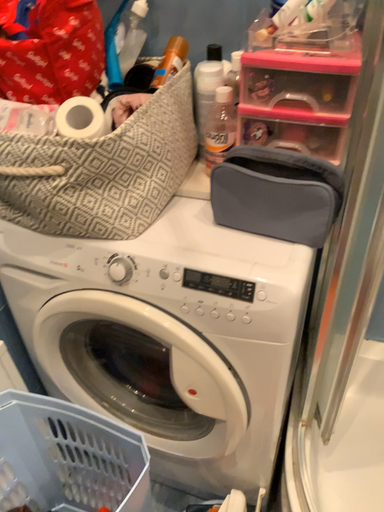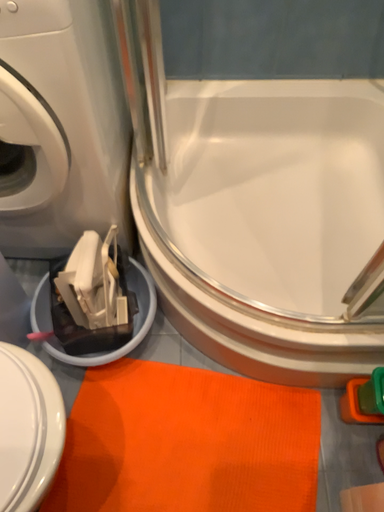
Question: How did the camera likely rotate when shooting the video?

Choices:
 (A) rotated right
 (B) rotated left

Answer: (A)